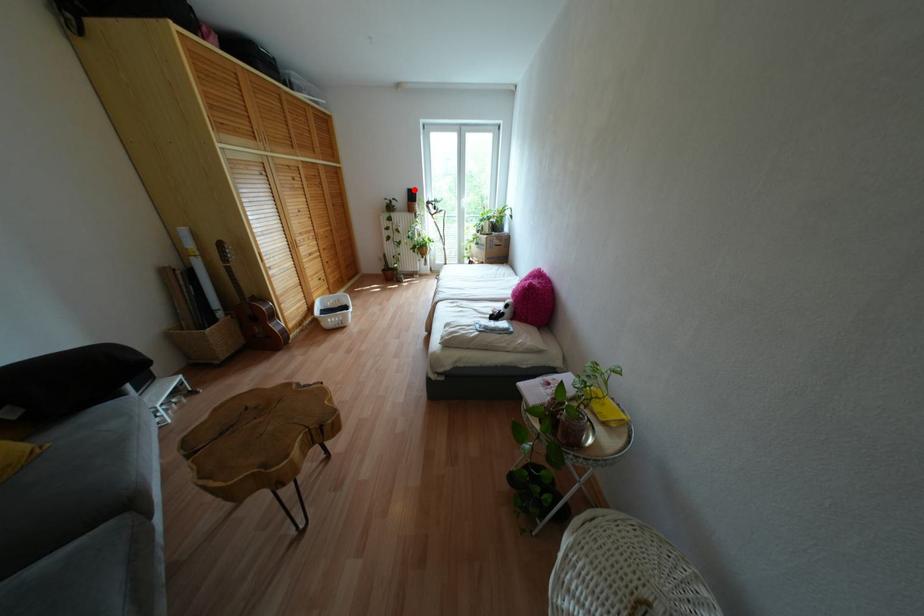
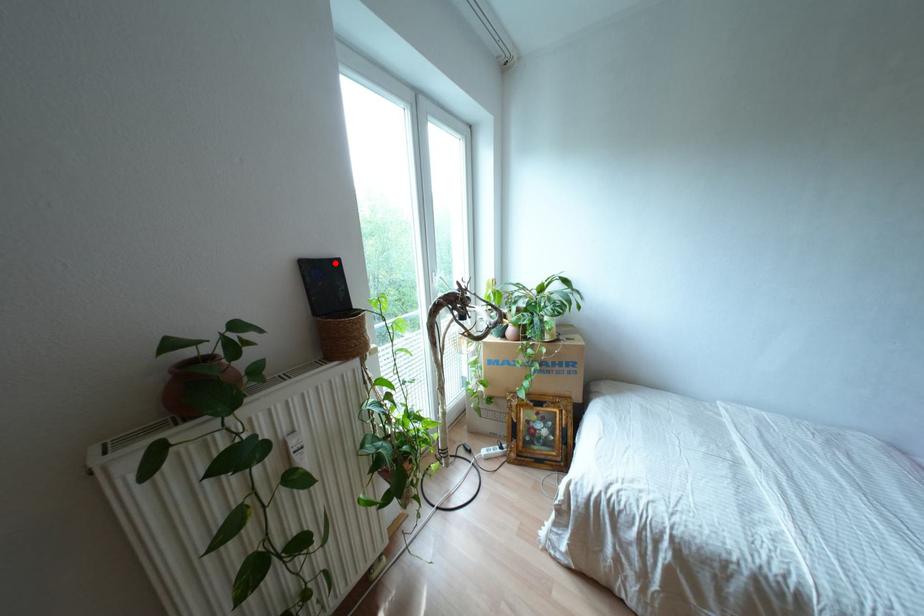
I am providing you with two images of the same scene from different viewpoints. A red point is marked on the first image and another point is marked on the second image. Is the marked point in image1 the same physical position as the marked point in image2?

Yes